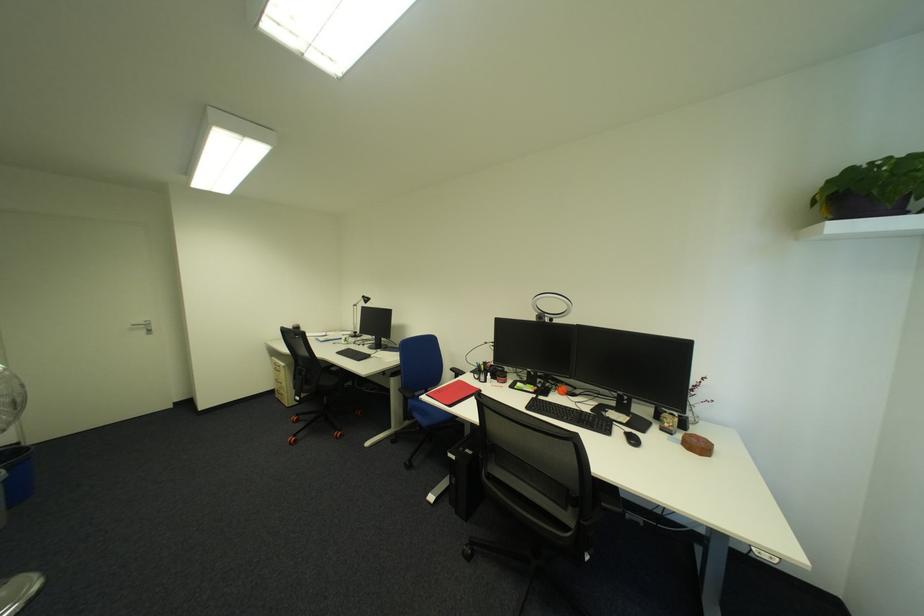
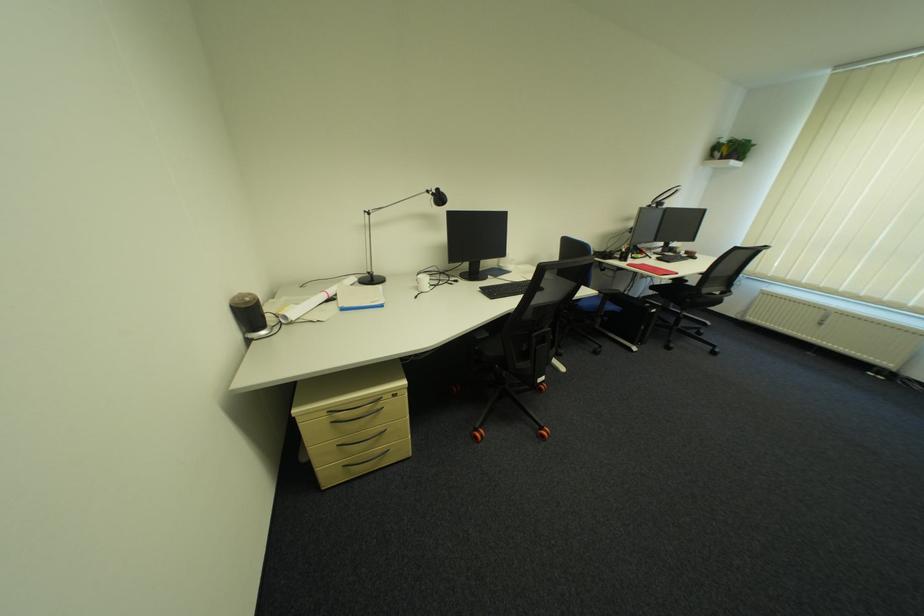
In the second image, find the point that corresponds to the point at 676,426 in the first image.

(687, 252)